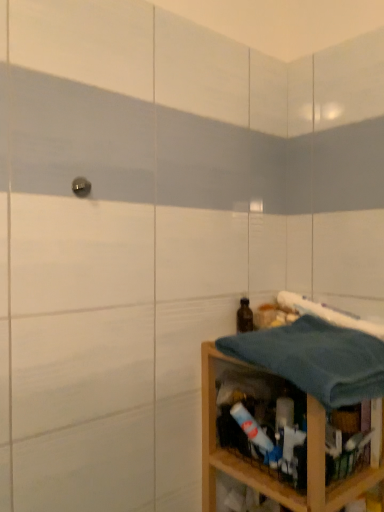
Question: From a real-world perspective, is brown glass bottle at lower right on blue waffle weave bath towel at right, which is the second bath towel from bottom to top?

Choices:
 (A) no
 (B) yes

Answer: (A)

Question: Considering the relative sizes of brown glass bottle at lower right and blue waffle weave bath towel at right, which is the second bath towel from bottom to top, in the image provided, is brown glass bottle at lower right wider than blue waffle weave bath towel at right, which is the second bath towel from bottom to top,?

Choices:
 (A) no
 (B) yes

Answer: (A)

Question: Does brown glass bottle at lower right have a larger size compared to blue waffle weave bath towel at right, which is the second bath towel from bottom to top?

Choices:
 (A) no
 (B) yes

Answer: (A)

Question: From a real-world perspective, is brown glass bottle at lower right positioned under blue waffle weave bath towel at right, which is the second bath towel from bottom to top, based on gravity?

Choices:
 (A) no
 (B) yes

Answer: (B)

Question: Would you consider brown glass bottle at lower right to be distant from blue waffle weave bath towel at right, arranged as the 1th bath towel when viewed from the top?

Choices:
 (A) yes
 (B) no

Answer: (B)

Question: From the image's perspective, is wooden shelf at lower right located above or below blue waffle weave bath towel at right, which is the second bath towel from bottom to top?

Choices:
 (A) above
 (B) below

Answer: (B)

Question: Relative to blue waffle weave bath towel at right, arranged as the 1th bath towel when viewed from the top, is wooden shelf at lower right in front or behind?

Choices:
 (A) front
 (B) behind

Answer: (A)

Question: From a real-world perspective, is wooden shelf at lower right physically located above or below blue waffle weave bath towel at right, arranged as the 1th bath towel when viewed from the top?

Choices:
 (A) above
 (B) below

Answer: (B)

Question: Is wooden shelf at lower right wider or thinner than blue waffle weave bath towel at right, which is the second bath towel from bottom to top?

Choices:
 (A) thin
 (B) wide

Answer: (B)

Question: Considering their positions, is brown glass bottle at lower right located in front of or behind blue waffle weave bath towel at right, which is the second bath towel from bottom to top?

Choices:
 (A) front
 (B) behind

Answer: (B)

Question: Does point (251, 309) appear closer or farther from the camera than point (326, 312)?

Choices:
 (A) closer
 (B) farther

Answer: (B)

Question: From the image's perspective, is brown glass bottle at lower right located above or below blue waffle weave bath towel at right, arranged as the 1th bath towel when viewed from the top?

Choices:
 (A) below
 (B) above

Answer: (A)

Question: From their relative heights in the image, would you say brown glass bottle at lower right is taller or shorter than blue waffle weave bath towel at right, which is the second bath towel from bottom to top?

Choices:
 (A) tall
 (B) short

Answer: (A)

Question: From a real-world perspective, is blue waffle weave bath towel at right, arranged as the 1th bath towel when viewed from the top, above or below blue cotton towel at lower right, the first bath towel from the bottom?

Choices:
 (A) below
 (B) above

Answer: (B)

Question: Would you say blue waffle weave bath towel at right, which is the second bath towel from bottom to top, is to the left or to the right of blue cotton towel at lower right, acting as the 2th bath towel starting from the top, in the picture?

Choices:
 (A) right
 (B) left

Answer: (A)